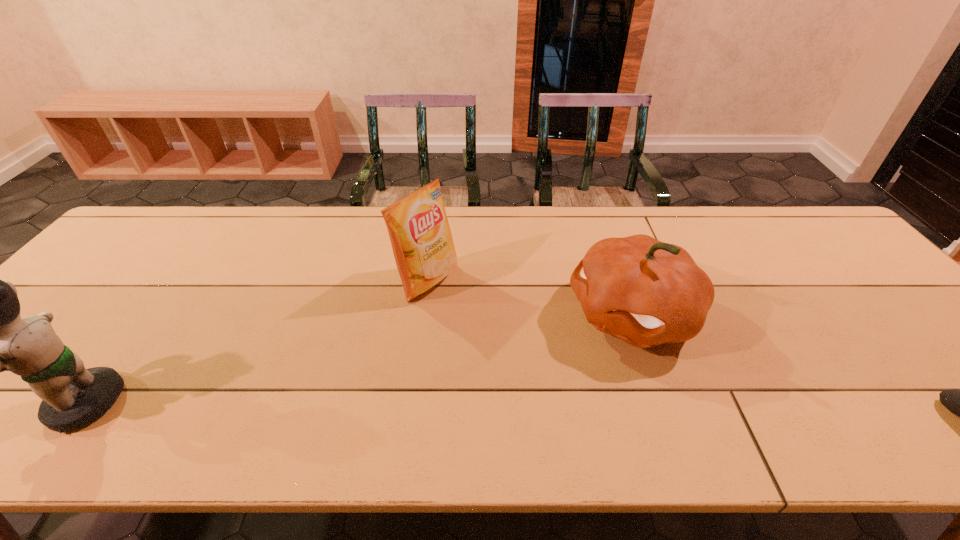
Locate which object is the third closest to the crisp (potato chip). Please provide its 2D coordinates. Your answer should be formatted as a tuple, i.e. [(x, y)], where the tuple contains the x and y coordinates of a point satisfying the conditions above.

[(959, 402)]

Identify the location of free point that satisfies the following two spatial constraints: 1. on the front side of the crisp (potato chip); 2. on the left side of the pumpkin. (423, 314).